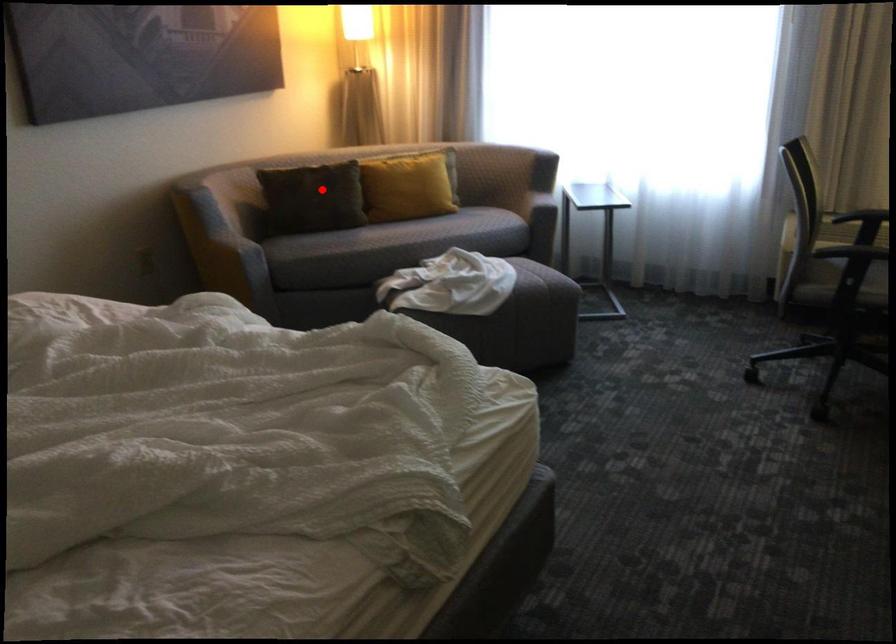
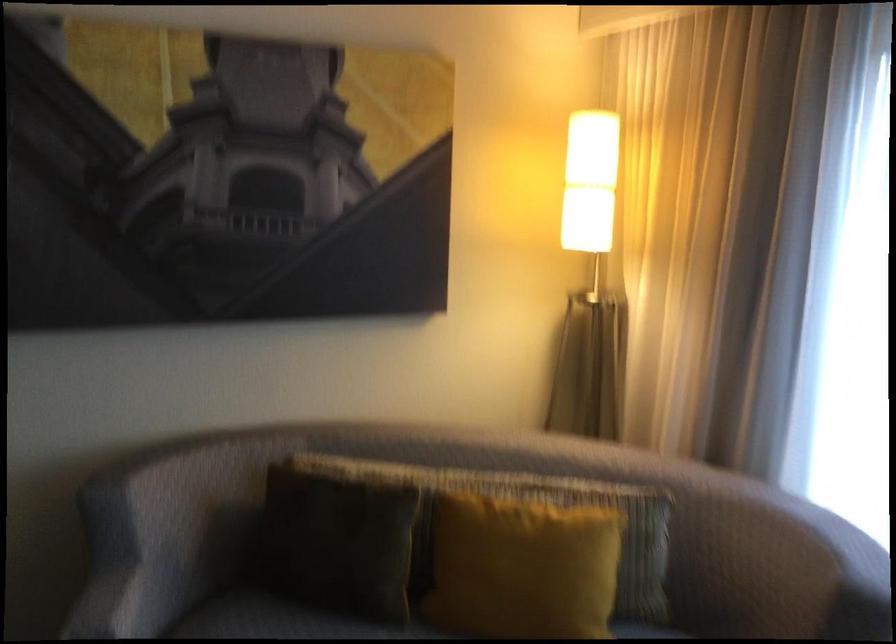
Question: I am providing you with two images of the same scene from different viewpoints. Image1 has a red point marked. In image2, the corresponding 3D location appears at what relative position? Reply with the corresponding letter.

Choices:
 (A) Closer
 (B) Farther

Answer: (A)